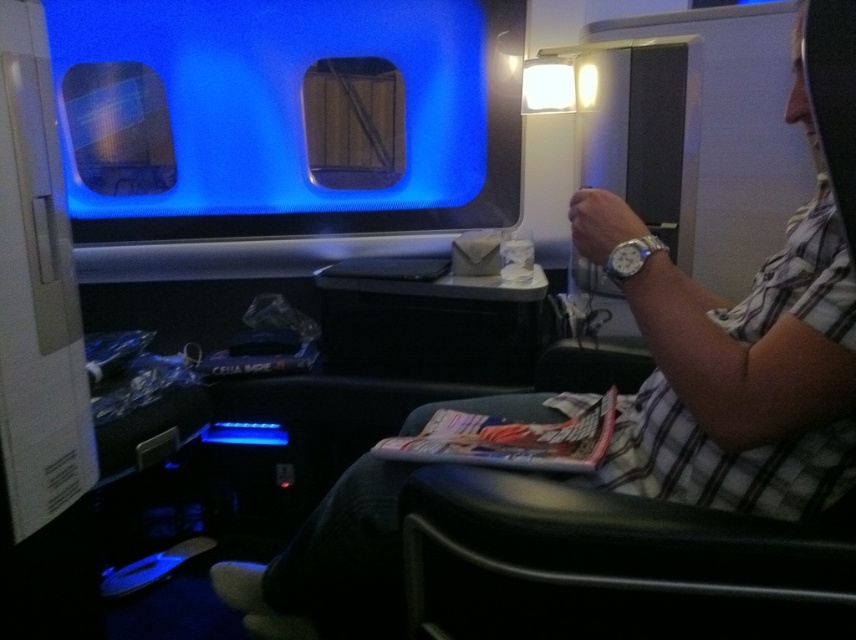
Does transparent plastic airplane window at upper center appear on the right side of printed paper magazine at center?

In fact, transparent plastic airplane window at upper center is to the left of printed paper magazine at center.

What do you see at coordinates (281, 96) in the screenshot? Image resolution: width=856 pixels, height=640 pixels. I see `transparent plastic airplane window at upper center` at bounding box center [281, 96].

Which is in front, point (197, 152) or point (544, 454)?

Point (544, 454)

Where is `transparent plastic airplane window at upper center`? This screenshot has width=856, height=640. transparent plastic airplane window at upper center is located at coordinates (281, 96).